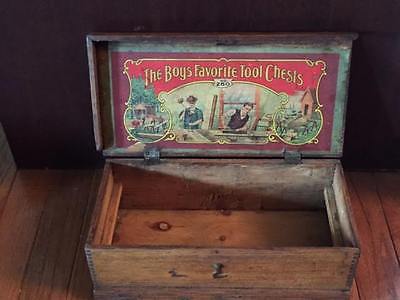
Find the location of a particular element. This screenshot has height=300, width=400. chest is located at coordinates (318, 264).